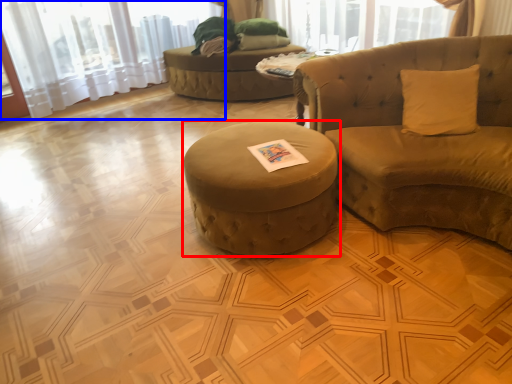
Question: Among these objects, which one is nearest to the camera, table (highlighted by a red box) or curtain (highlighted by a blue box)?

Choices:
 (A) table
 (B) curtain

Answer: (A)